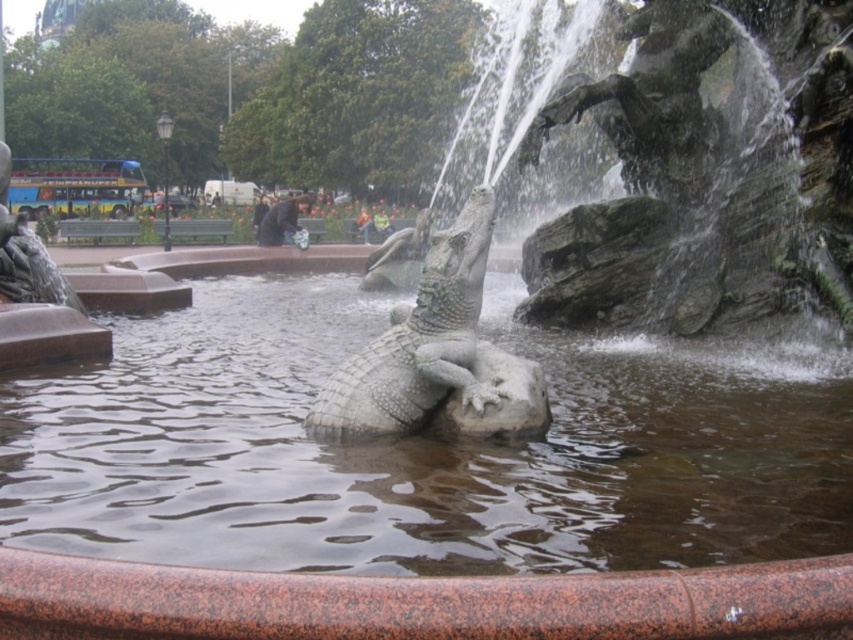
Is point (688, 545) positioned after point (473, 394)?

No.

Does smooth stone water at center lie in front of polished stone crocodile at center?

Yes.

Where is `smooth stone water at center`? Image resolution: width=853 pixels, height=640 pixels. smooth stone water at center is located at coordinates (422, 449).